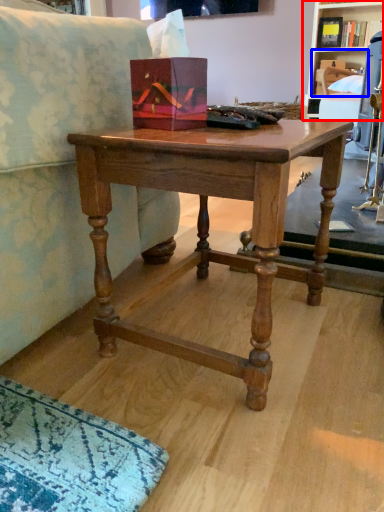
Question: Which point is closer to the camera, shelf (highlighted by a red box) or shelf (highlighted by a blue box)?

Choices:
 (A) shelf
 (B) shelf

Answer: (A)